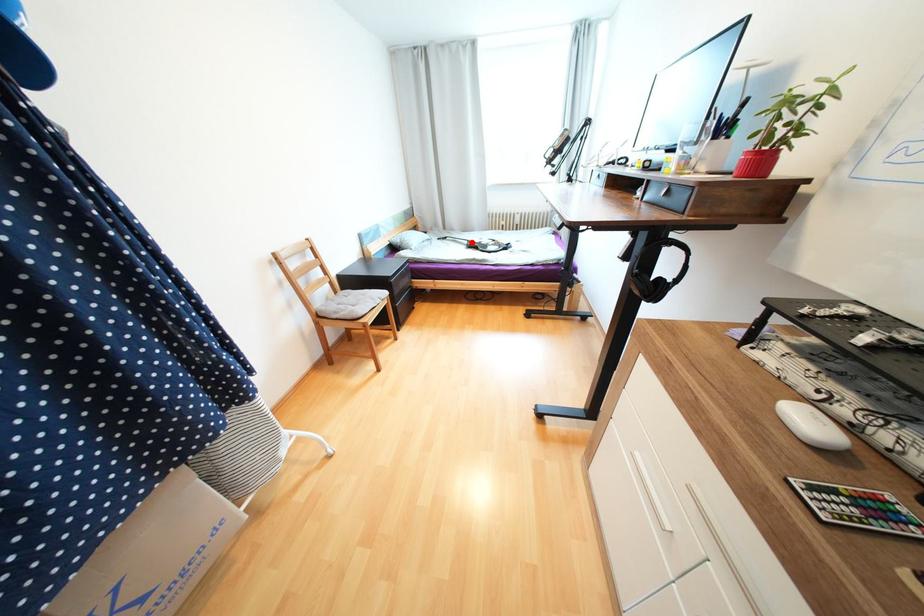
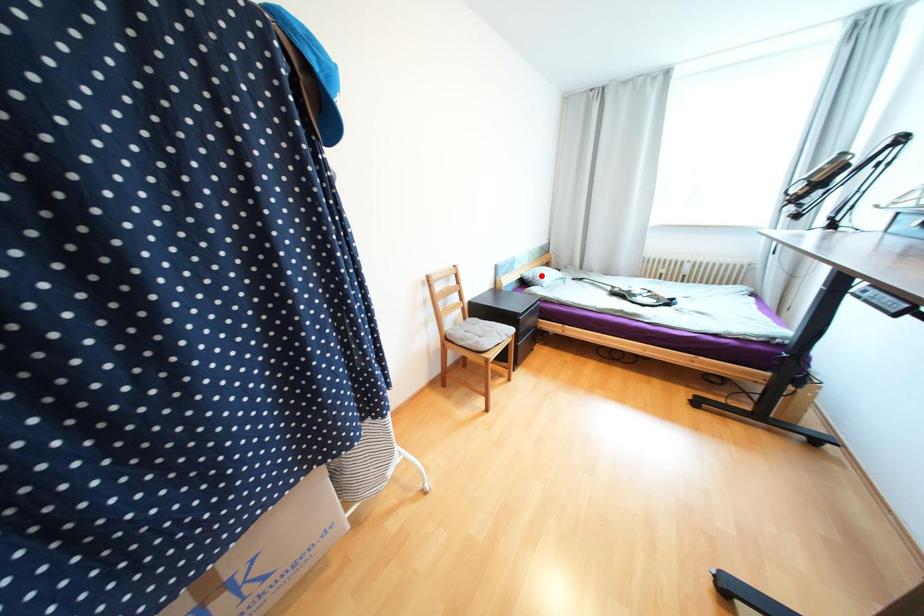
I am providing you with two images of the same scene from different viewpoints. A red point is marked on the first image and another point is marked on the second image. Are the points marked in image1 and image2 representing the same 3D position?

No